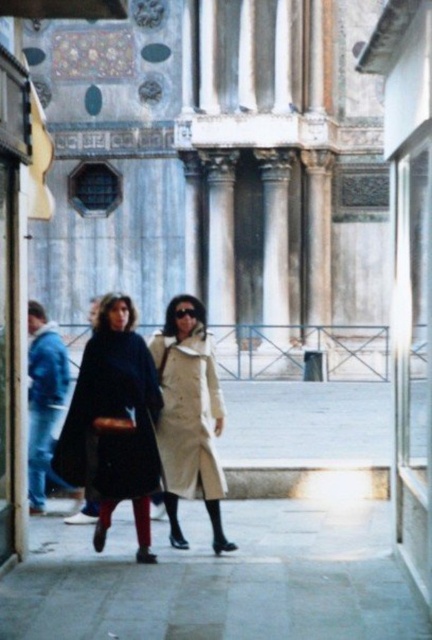
In the scene shown: Can you confirm if matte black cape at center is positioned above light beige wool coat at center?

No.

Who is positioned more to the left, matte black cape at center or light beige wool coat at center?

From the viewer's perspective, matte black cape at center appears more on the left side.

The width and height of the screenshot is (432, 640). In order to click on matte black cape at center in this screenshot , I will do `click(114, 419)`.

Where is `matte black cape at center`? Image resolution: width=432 pixels, height=640 pixels. matte black cape at center is located at coordinates (114, 419).

Is matte black cape at center to the right of denim jacket at lower left from the viewer's perspective?

Correct, you'll find matte black cape at center to the right of denim jacket at lower left.

Is matte black cape at center further to camera compared to denim jacket at lower left?

No, it is in front of denim jacket at lower left.

Does point (148, 465) come farther from viewer compared to point (34, 404)?

No, it is in front of (34, 404).

Locate an element on the screen. matte black cape at center is located at coordinates (114, 419).

Is light beige wool coat at center above denim jacket at lower left?

Yes, light beige wool coat at center is above denim jacket at lower left.

You are a GUI agent. You are given a task and a screenshot of the screen. Output one action in this format:
    pyautogui.click(x=<x>, y=<y>)
    Task: Click on the light beige wool coat at center
    This screenshot has height=640, width=432.
    Given the screenshot: What is the action you would take?
    pyautogui.click(x=189, y=416)